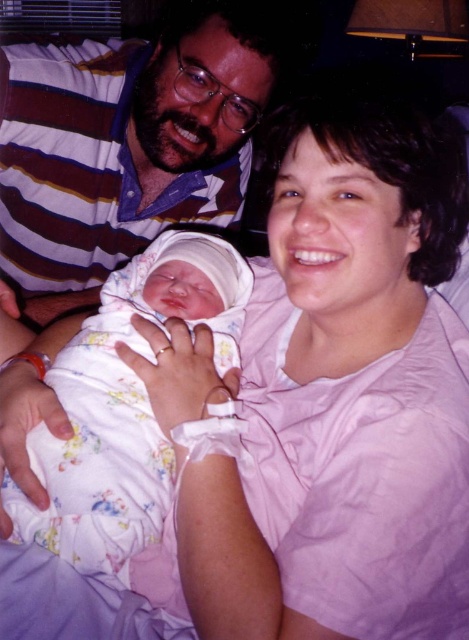
You are a photographer adjusting your camera to focus on two specific points in the image. The first point is at coordinates point [115,173] and the second point is at point [17,490]. Which point should you focus on first if you want to capture the closest object to the camera?

Point [115,173] is further to the camera than point [17,490], so you should focus on point [115,173] first as it is closer to the camera.

In the scene described, there are two items visible to the observer. The first is the matte striped shirt at upper left, and the second is the floral cotton swaddle at center. Based on their positions, which item is closer to the observer?

The floral cotton swaddle at center is behind the matte striped shirt at upper left, so the matte striped shirt at upper left is closer to the observer.

You are a photographer taking a picture of the scene. You want to ensure the matte striped shirt at upper left and the floral cotton swaddle at center are both in focus. Which object should you position the camera focus closer to?

The matte striped shirt at upper left is to the left of the floral cotton swaddle at center. Since they are positioned side by side horizontally, the camera focus should be centered between them to ensure both are in focus.